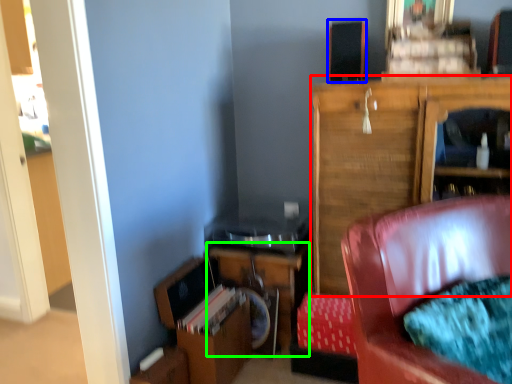
Question: Based on their relative distances, which object is farther from cabinetry (highlighted by a red box)? Choose from speaker (highlighted by a blue box) and table (highlighted by a green box).

Choices:
 (A) speaker
 (B) table

Answer: (B)